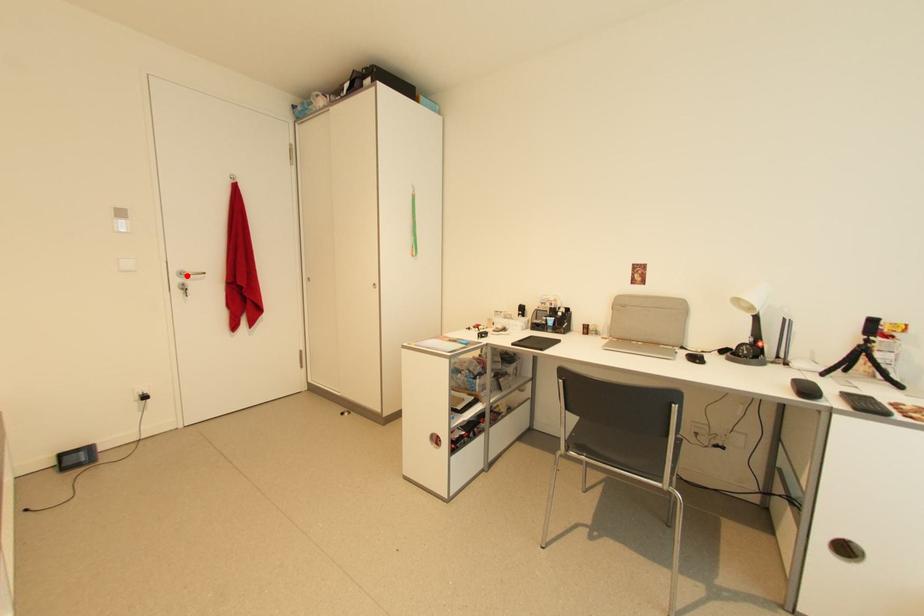
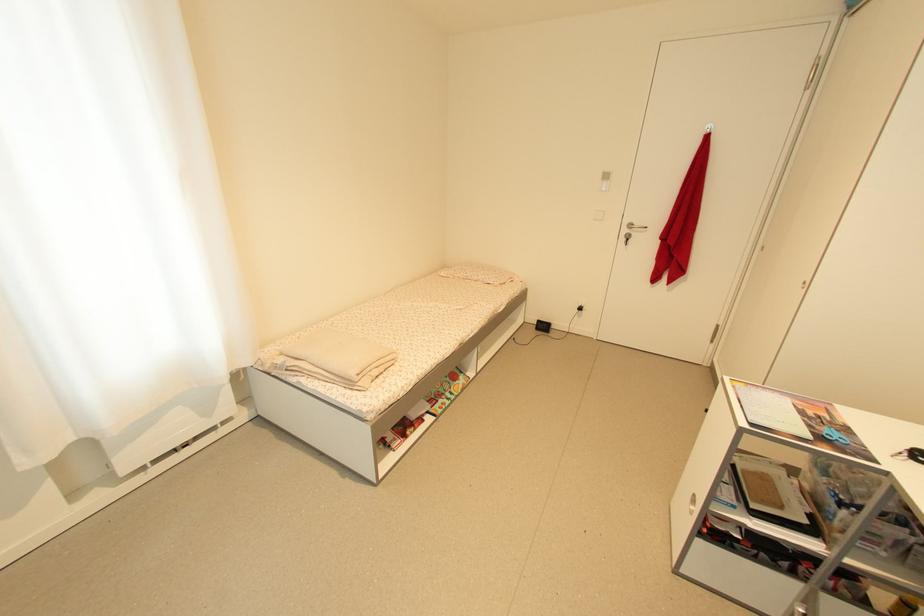
The point at the highlighted location is marked in the first image. Where is the corresponding point in the second image?

(636, 227)